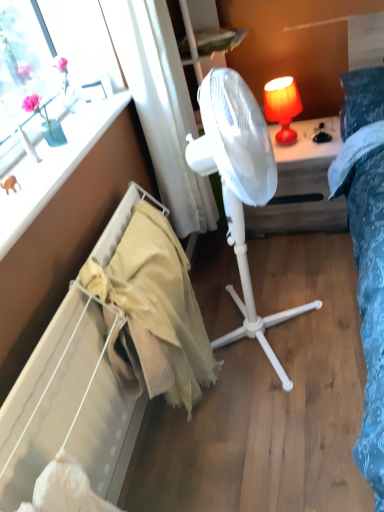
You are a GUI agent. You are given a task and a screenshot of the screen. Output one action in this format:
    pyautogui.click(x=<x>, y=<y>)
    Task: Click on the vacant area that is situated to the right of white plastic fan at center
    The width and height of the screenshot is (384, 512).
    Given the screenshot: What is the action you would take?
    pyautogui.click(x=335, y=300)